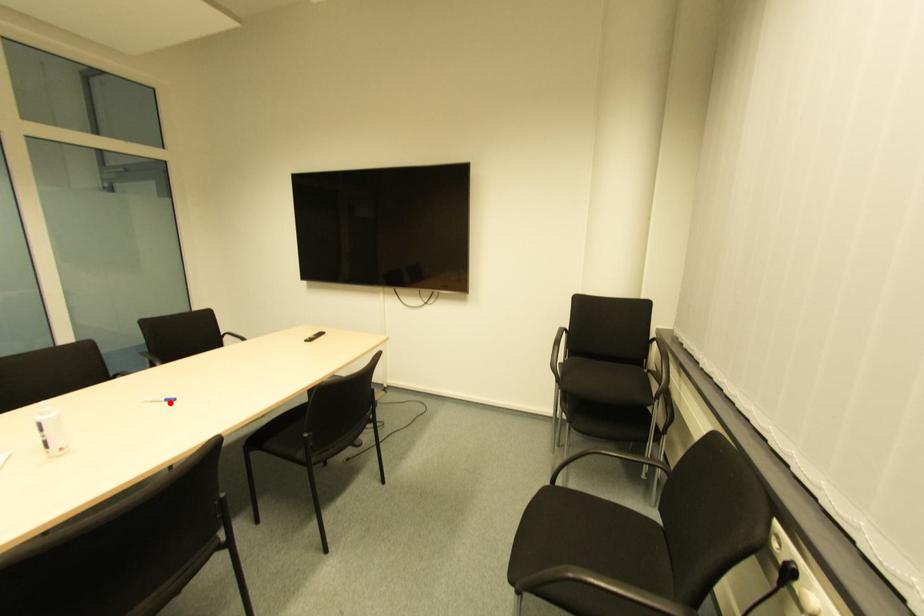
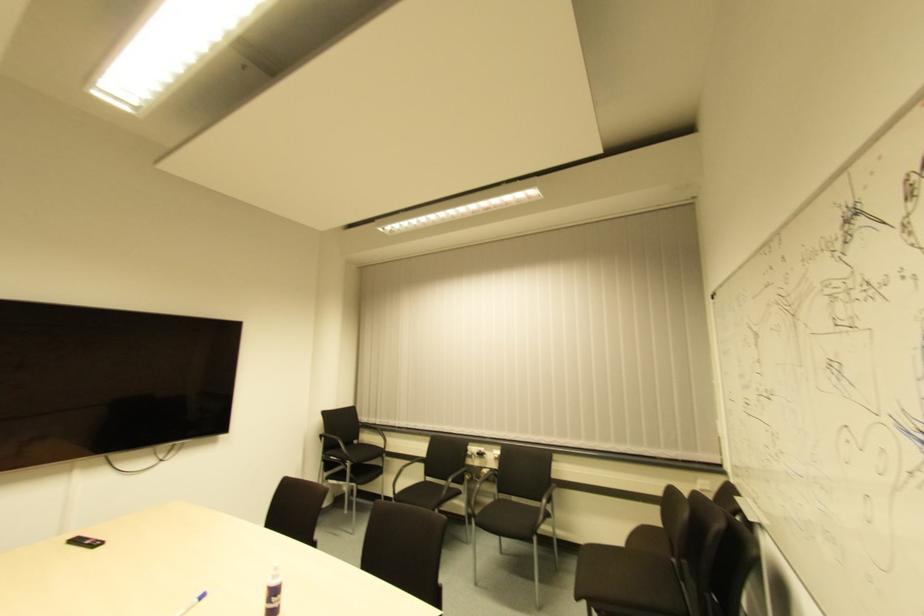
The point at the highlighted location is marked in the first image. Where is the corresponding point in the second image?

(202, 600)